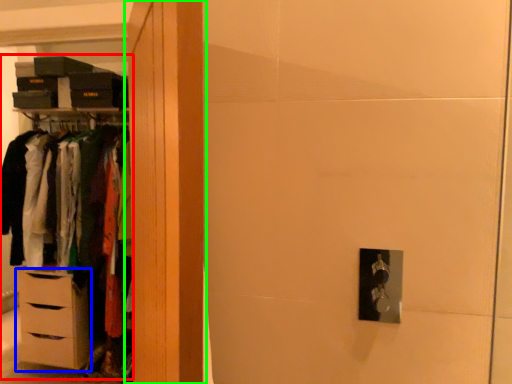
Question: Considering the real-world distances, which object is farthest from dresser (highlighted by a red box)? chest of drawers (highlighted by a blue box) or armoire (highlighted by a green box)?

Choices:
 (A) chest of drawers
 (B) armoire

Answer: (B)